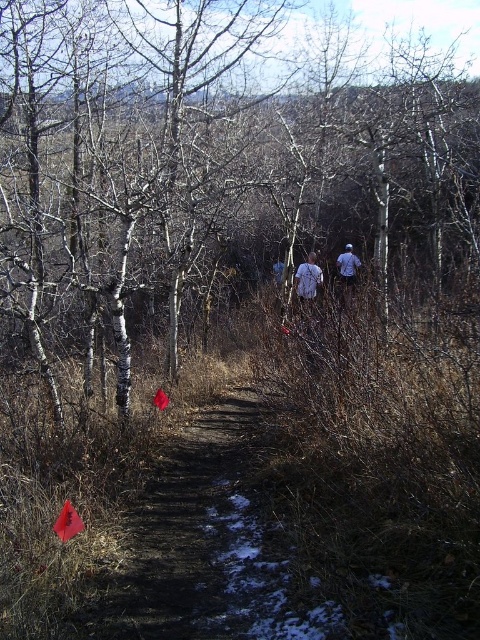
Question: Does white bark tree at center appear on the right side of white matte shirt at center?

Choices:
 (A) yes
 (B) no

Answer: (B)

Question: Does white bark tree at center appear on the left side of white matte shirt at center?

Choices:
 (A) no
 (B) yes

Answer: (B)

Question: Which object is the closest to the white bark tree at center?

Choices:
 (A) white matte shirt at center
 (B) blue denim jacket at center

Answer: (A)

Question: Is white bark tree at center in front of white matte shirt at center?

Choices:
 (A) no
 (B) yes

Answer: (B)

Question: Which point is farther to the camera?

Choices:
 (A) (303, 288)
 (B) (343, 301)
 (C) (51, 211)

Answer: (A)

Question: Among these objects, which one is nearest to the camera?

Choices:
 (A) blue denim jacket at center
 (B) white matte shirt at center
 (C) white bark tree at center

Answer: (C)